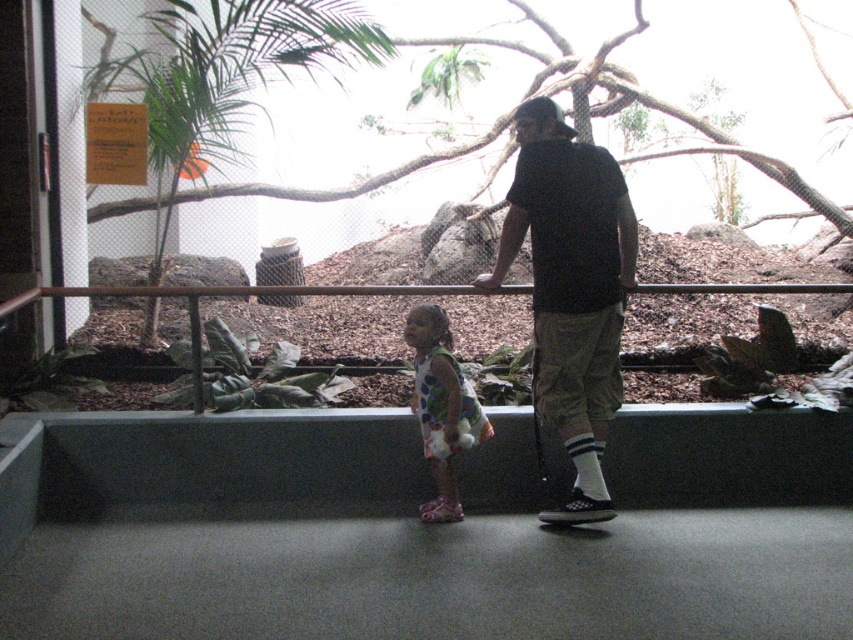
Question: Does dark gray cotton shirt at center have a greater width compared to printed fabric dress at center?

Choices:
 (A) no
 (B) yes

Answer: (B)

Question: Can you confirm if dark gray cotton shirt at center is positioned to the right of printed fabric dress at center?

Choices:
 (A) yes
 (B) no

Answer: (A)

Question: Is dark gray cotton shirt at center smaller than printed fabric dress at center?

Choices:
 (A) no
 (B) yes

Answer: (A)

Question: Which point is closer to the camera?

Choices:
 (A) dark gray cotton shirt at center
 (B) printed fabric dress at center

Answer: (A)